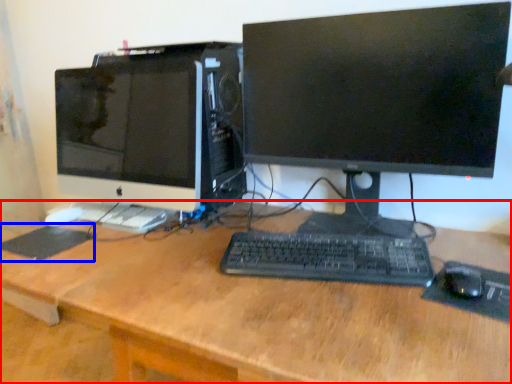
Question: Among these objects, which one is farthest to the camera, desk (highlighted by a red box) or mousepad (highlighted by a blue box)?

Choices:
 (A) desk
 (B) mousepad

Answer: (B)